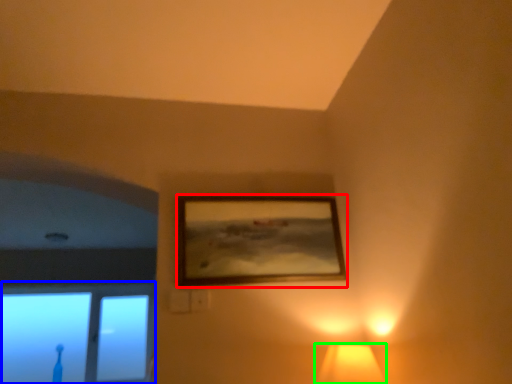
Question: Considering the real-world distances, which object is closest to picture frame (highlighted by a red box)? window (highlighted by a blue box) or lamp (highlighted by a green box).

Choices:
 (A) window
 (B) lamp

Answer: (B)